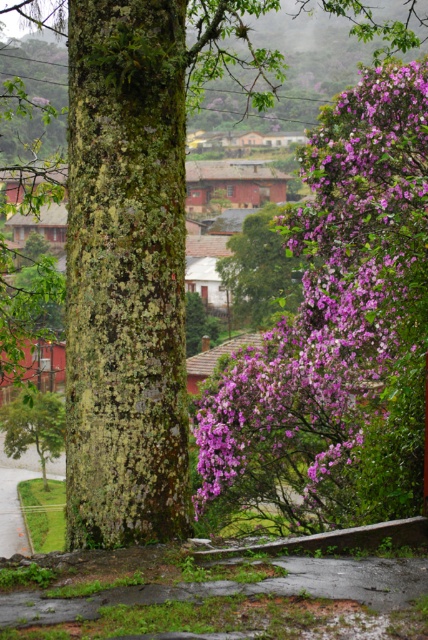
You are a hiker who wants to take a photo of both the purple matte flower at right and the green mossy tree at lower left in the same frame. Given that your camera has a maximum focal length that allows capturing objects within 10 meters of each other, will you be able to include both in a single shot?

The distance between the purple matte flower at right and the green mossy tree at lower left is 11.71 meters, which exceeds the camera maximum focal length of 10 meters. Therefore, you cannot capture both in a single shot.

You are a photographer standing in the scene and want to take a picture of the purple matte flower at right and the green mossy tree at lower left. Which object will appear larger in the photo if you focus on them equally?

The purple matte flower at right will appear larger in the photo because it is closer to the viewer than the green mossy tree at lower left.